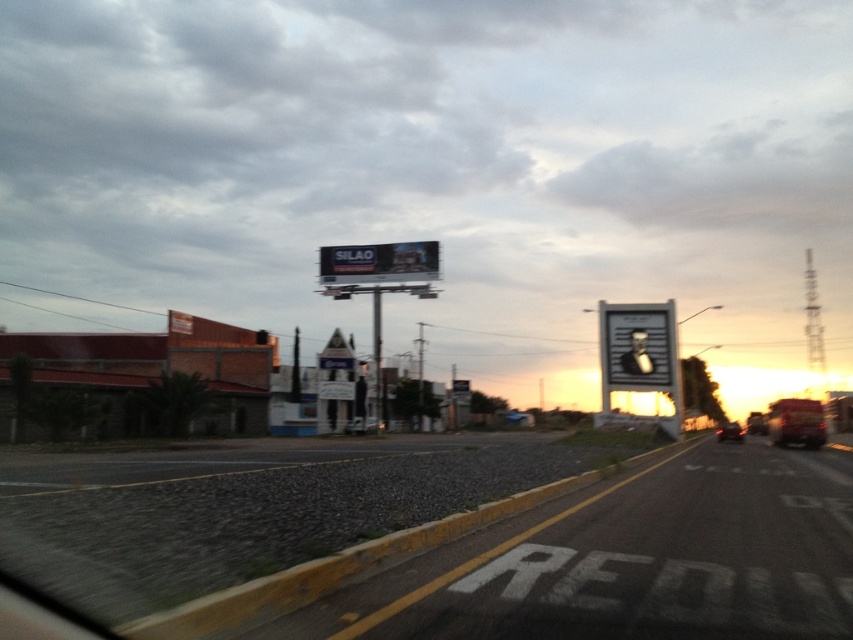
Is metallic silver billboard at center above shiny black car at center?

Yes.

Does metallic silver billboard at center appear on the right side of shiny black car at center?

No, metallic silver billboard at center is not to the right of shiny black car at center.

Between point (405, 262) and point (737, 440), which one is positioned behind?

Positioned behind is point (405, 262).

The image size is (853, 640). Identify the location of metallic silver billboard at center. (379, 262).

Between metallic silver portrait at right and metallic red truck at right, which one has more height?

Standing taller between the two is metallic red truck at right.

Measure the distance between metallic silver portrait at right and metallic red truck at right.

They are 14.30 meters apart.

Between point (640, 333) and point (778, 420), which one is positioned behind?

Point (640, 333)

I want to click on metallic silver portrait at right, so click(640, 355).

Between brown brick building at left and metallic red truck at right, which one is positioned lower?

metallic red truck at right is lower down.

Which of these two, brown brick building at left or metallic red truck at right, stands taller?

metallic red truck at right

Find the location of `brown brick building at left`. brown brick building at left is located at coordinates (146, 372).